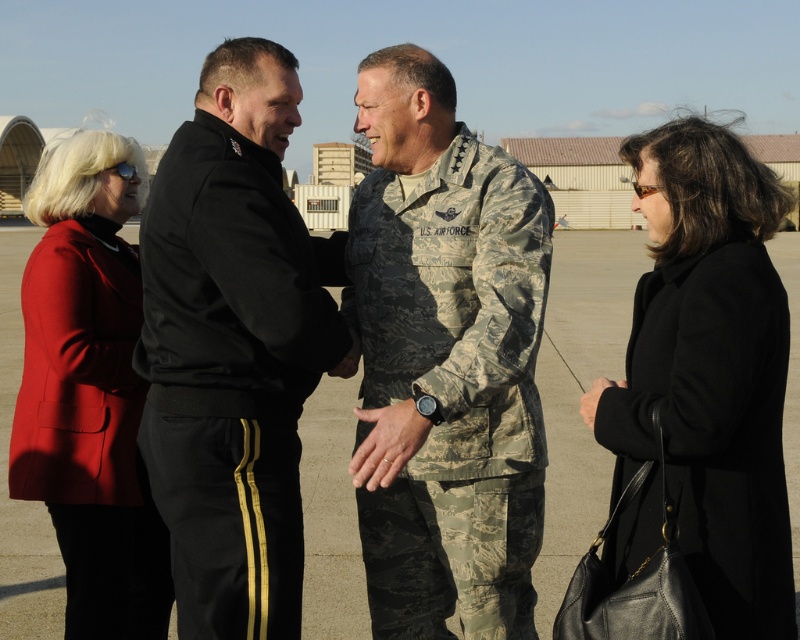
Question: Is black leather coat at lower right thinner than matte red blazer at left?

Choices:
 (A) no
 (B) yes

Answer: (B)

Question: Does black matte uniform at center lie behind matte red blazer at left?

Choices:
 (A) yes
 (B) no

Answer: (B)

Question: Based on their relative distances, which object is farther from the matte red blazer at left?

Choices:
 (A) black leather coat at lower right
 (B) black matte uniform at center
 (C) camouflage uniform at center

Answer: (A)

Question: Is black matte uniform at center in front of black leather coat at lower right?

Choices:
 (A) no
 (B) yes

Answer: (A)

Question: Which object appears closest to the camera in this image?

Choices:
 (A) black matte uniform at center
 (B) matte red blazer at left

Answer: (A)

Question: Considering the real-world distances, which object is closest to the black matte uniform at center?

Choices:
 (A) matte red blazer at left
 (B) camouflage uniform at center

Answer: (B)